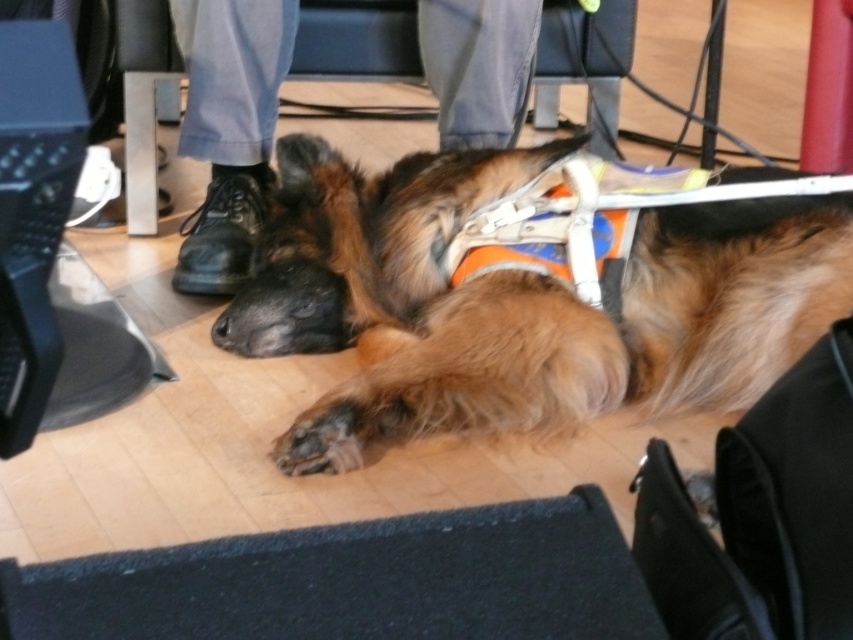
Question: Considering the relative positions of brown fur dog at center and black leather shoes at lower center in the image provided, where is brown fur dog at center located with respect to black leather shoes at lower center?

Choices:
 (A) left
 (B) right

Answer: (B)

Question: Which point is closer to the camera taking this photo?

Choices:
 (A) (311, 308)
 (B) (225, 8)
 (C) (262, 19)

Answer: (A)

Question: Which object is the farthest from the brown fur dog at center?

Choices:
 (A) black leather shoes at lower left
 (B) black leather shoes at lower center

Answer: (B)

Question: Which is farther from the black leather shoes at lower center?

Choices:
 (A) brown fur dog at center
 (B) black leather shoes at lower left

Answer: (A)

Question: Is black leather shoes at lower center to the left of black leather shoes at lower left from the viewer's perspective?

Choices:
 (A) no
 (B) yes

Answer: (B)

Question: In this image, where is brown fur dog at center located relative to black leather shoes at lower center?

Choices:
 (A) right
 (B) left

Answer: (A)